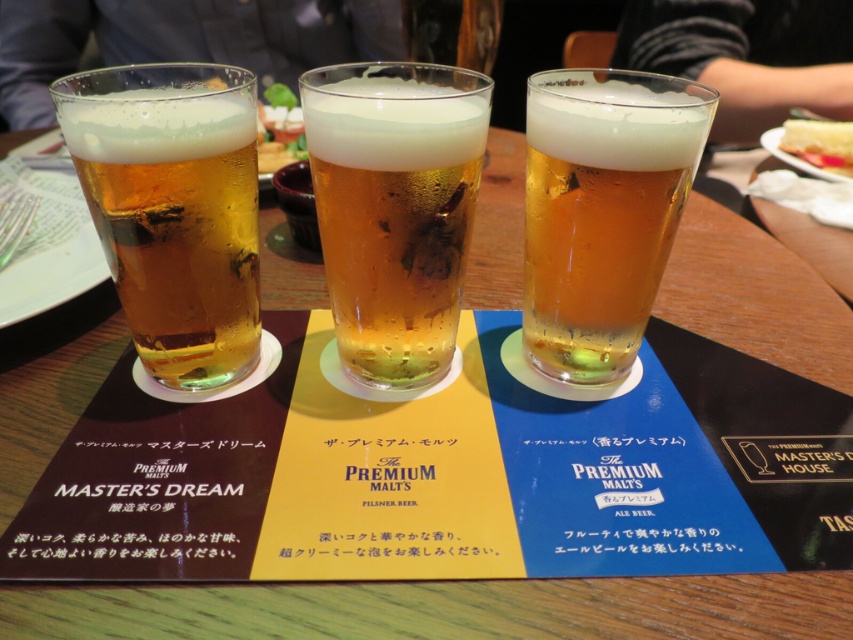
Is translucent amber glass at left closer to the viewer compared to green leafy vegetable at center?

Yes, it is in front of green leafy vegetable at center.

Is point (163, 202) closer to viewer compared to point (283, 100)?

Yes.

Measure the distance between point (x=167, y=342) and camera.

A distance of 14.54 inches exists between point (x=167, y=342) and camera.

Locate an element on the screen. translucent amber glass at left is located at coordinates (175, 221).

Is translucent amber glass at center thinner than translucent amber glass at left?

Indeed, translucent amber glass at center has a lesser width compared to translucent amber glass at left.

Does point (331, 275) come behind point (198, 100)?

Yes, point (331, 275) is farther from viewer.

What are the coordinates of `translucent amber glass at center` in the screenshot? It's located at (393, 209).

This screenshot has width=853, height=640. What do you see at coordinates (393, 209) in the screenshot?
I see `translucent amber glass at center` at bounding box center [393, 209].

Does point (392, 220) come in front of point (578, 340)?

Yes, point (392, 220) is closer to viewer.

This screenshot has width=853, height=640. In order to click on translucent amber glass at center in this screenshot , I will do `click(393, 209)`.